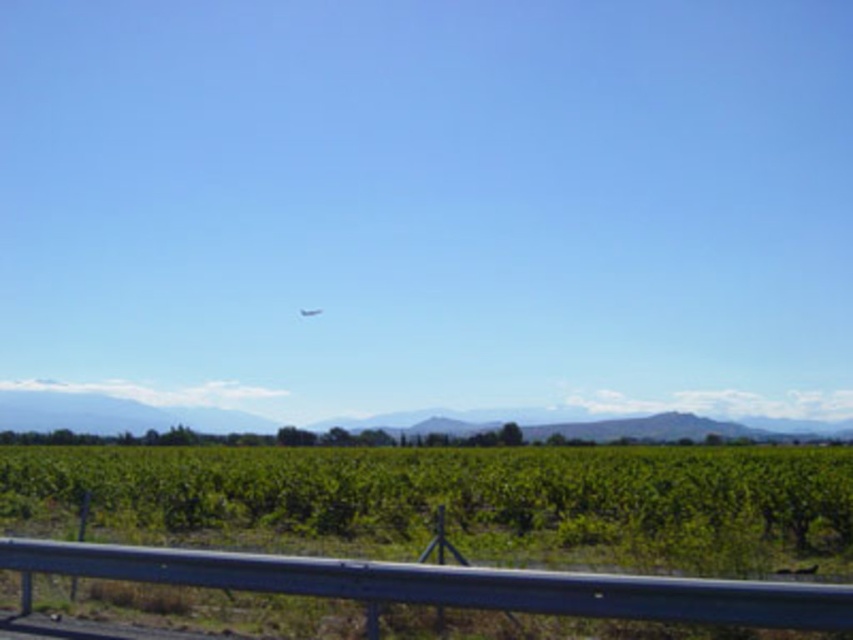
You are a photographer standing at the edge of the road. You want to capture a photo of the green leafy vineyard at lower center and the transparent glass plane at center. According to the scene, which object is closer to you?

The green leafy vineyard at lower center is closer to you since it is located below the transparent glass plane at center, meaning it is positioned in front of it from your perspective.

Consider the image. You are standing at the guardrail in the image. The green leafy vineyard at lower center is located at coordinates point 0.783, 0.547. If you want to walk directly towards the vineyard, which direction should you move relative to your current position?

The green leafy vineyard at lower center is located at coordinates point (466, 500). Since the coordinates are given in normalized image space, moving towards the lower center direction from the guardrail would lead you directly towards the vineyard.

You are a photographer wanting to capture a landscape photo that includes both the green leafy vineyard at lower center and the transparent glass plane at center. Which object should you focus on first if you want to ensure both are in sharp focus?

The green leafy vineyard at lower center is larger than the transparent glass plane at center, so focusing on the larger object first will help ensure both are in sharp focus.